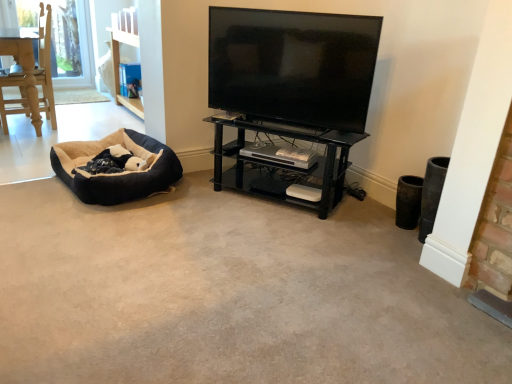
Where is `black glossy tv at upper center`? Image resolution: width=512 pixels, height=384 pixels. black glossy tv at upper center is located at coordinates (293, 66).

At what (x,y) coordinates should I click in order to perform the action: click on soft suede dog bed at left. Please return your answer as a coordinate pair (x, y). This screenshot has width=512, height=384. Looking at the image, I should click on (116, 174).

From the image's perspective, relative to black glossy tv at upper center, is soft suede dog bed at left above or below?

From the image's perspective, soft suede dog bed at left appears below black glossy tv at upper center.

From a real-world perspective, is soft suede dog bed at left positioned over black glossy tv at upper center based on gravity?

Incorrect, from a real-world perspective, soft suede dog bed at left is lower than black glossy tv at upper center.

Looking at the image, does soft suede dog bed at left seem bigger or smaller compared to black glossy tv at upper center?

Clearly, soft suede dog bed at left is larger in size than black glossy tv at upper center.

Where is `television above the soft suede dog bed at left (from the image's perspective)`? television above the soft suede dog bed at left (from the image's perspective) is located at coordinates (293, 66).

Consider the image. Is black glass shelf at center facing towards black glossy tv at upper center?

No, black glass shelf at center does not turn towards black glossy tv at upper center.

Is black glass shelf at center further to camera compared to black glossy tv at upper center?

Yes, black glass shelf at center is further from the camera.

Is point (285, 181) positioned behind point (247, 82)?

Yes, it is.

Can we say soft suede dog bed at left lies outside black glass shelf at center?

soft suede dog bed at left lies outside black glass shelf at center's area.

Considering the relative positions of soft suede dog bed at left and black glass shelf at center in the image provided, is soft suede dog bed at left to the left or to the right of black glass shelf at center?

From the image, it's evident that soft suede dog bed at left is to the left of black glass shelf at center.

Does soft suede dog bed at left have a greater height compared to black glass shelf at center?

No.

In the image, is soft suede dog bed at left positioned in front of or behind black glass shelf at center?

soft suede dog bed at left is positioned farther from the viewer than black glass shelf at center.

Consider the image. Can you confirm if black glossy tv at upper center is positioned to the left of black glass shelf at center?

Correct, you'll find black glossy tv at upper center to the left of black glass shelf at center.

Does point (294, 97) appear closer or farther from the camera than point (234, 181)?

Point (294, 97).

Based on the photo, from the image's perspective, is black glossy tv at upper center under black glass shelf at center?

No, from the image's perspective, black glossy tv at upper center is not below black glass shelf at center.

Is black glossy tv at upper center wider than black glass shelf at center?

Incorrect, the width of black glossy tv at upper center does not surpass that of black glass shelf at center.

Is black glass shelf at center smaller than soft suede dog bed at left?

No.

Would you say black glass shelf at center is outside soft suede dog bed at left?

black glass shelf at center lies outside soft suede dog bed at left's area.

Looking at this image, who is taller, black glass shelf at center or soft suede dog bed at left?

Standing taller between the two is black glass shelf at center.

Is black glass shelf at center with soft suede dog bed at left?

They are not placed beside each other.

Can you confirm if black glossy tv at upper center is taller than soft suede dog bed at left?

Yes.

Based on the photo, is black glossy tv at upper center inside the boundaries of soft suede dog bed at left, or outside?

black glossy tv at upper center is outside soft suede dog bed at left.

Considering the sizes of black glossy tv at upper center and soft suede dog bed at left in the image, is black glossy tv at upper center bigger or smaller than soft suede dog bed at left?

In the image, black glossy tv at upper center appears to be smaller than soft suede dog bed at left.

Locate an element on the screen. television in front of the soft suede dog bed at left is located at coordinates (293, 66).

I want to click on television on the left of the black glass shelf at center, so click(293, 66).

Based on their spatial positions, is soft suede dog bed at left or black glass shelf at center closer to black glossy tv at upper center?

The object closer to black glossy tv at upper center is black glass shelf at center.

Based on their spatial positions, is black glass shelf at center or black glossy tv at upper center closer to soft suede dog bed at left?

black glass shelf at center is closer to soft suede dog bed at left.

When comparing their distances from black glossy tv at upper center, does black glass shelf at center or soft suede dog bed at left seem closer?

Among the two, black glass shelf at center is located nearer to black glossy tv at upper center.

From the image, which object appears to be farther from black glass shelf at center, soft suede dog bed at left or black glossy tv at upper center?

soft suede dog bed at left is further to black glass shelf at center.

Looking at the image, which one is located closer to soft suede dog bed at left, black glossy tv at upper center or black glass shelf at center?

black glass shelf at center.

Considering their positions, is black glossy tv at upper center positioned closer to black glass shelf at center than soft suede dog bed at left?

black glossy tv at upper center.

Image resolution: width=512 pixels, height=384 pixels. Identify the location of television between soft suede dog bed at left and black glass shelf at center. (293, 66).